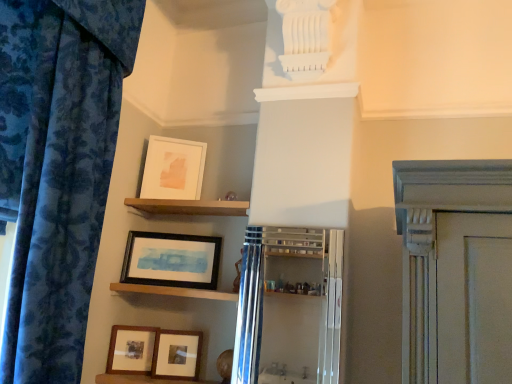
Measure the distance between point (215, 209) and camera.

A distance of 2.06 meters exists between point (215, 209) and camera.

What do you see at coordinates (177, 354) in the screenshot?
I see `wooden matte picture frame at lower center, which ranks as the fourth picture frame in top-to-bottom order` at bounding box center [177, 354].

This screenshot has width=512, height=384. Describe the element at coordinates (173, 291) in the screenshot. I see `wooden shelf at center, the 2th shelf positioned from the top` at that location.

Locate an element on the screen. wooden shelf at upper center, arranged as the 2th shelf when ordered from the bottom is located at coordinates (188, 207).

Is wooden framed picture at center, arranged as the second picture frame when viewed from the top, turned away from matte white picture frame at upper center, the first picture frame in the top-to-bottom sequence?

wooden framed picture at center, arranged as the second picture frame when viewed from the top, does not have its back to matte white picture frame at upper center, the first picture frame in the top-to-bottom sequence.

This screenshot has height=384, width=512. Identify the location of picture frame that is the 1st object to the right of the matte white picture frame at upper center, arranged as the 4th picture frame when ordered from the bottom, starting at the anchor. (170, 260).

Can you confirm if wooden framed picture at center, arranged as the second picture frame when viewed from the top, is smaller than matte white picture frame at upper center, arranged as the 4th picture frame when ordered from the bottom?

No.

Does blue floral fabric curtain at left contain wooden shelf at center, the 2th shelf positioned from the top?

That's incorrect, wooden shelf at center, the 2th shelf positioned from the top, is not inside blue floral fabric curtain at left.

In the scene shown: From the image's perspective, which one is positioned higher, blue floral fabric curtain at left or wooden shelf at center, which is the 1th shelf in bottom-to-top order?

From the image's view, blue floral fabric curtain at left is above.

From a real-world perspective, is blue floral fabric curtain at left physically below wooden shelf at center, the 2th shelf positioned from the top?

Incorrect, from a real-world perspective, blue floral fabric curtain at left is higher than wooden shelf at center, the 2th shelf positioned from the top.

Considering the sizes of objects wooden shelf at center, which is the 1th shelf in bottom-to-top order, and matte black picture frame at lower left, the 3th picture frame in the top-to-bottom sequence, in the image provided, who is shorter, wooden shelf at center, which is the 1th shelf in bottom-to-top order, or matte black picture frame at lower left, the 3th picture frame in the top-to-bottom sequence,?

wooden shelf at center, which is the 1th shelf in bottom-to-top order.

Is wooden shelf at center, the 2th shelf positioned from the top, positioned far away from matte black picture frame at lower left, the 3th picture frame in the top-to-bottom sequence?

They are positioned close to each other.

Looking at the image, does wooden shelf at center, which is the 1th shelf in bottom-to-top order, seem bigger or smaller compared to matte black picture frame at lower left, the 2th picture frame positioned from the bottom?

wooden shelf at center, which is the 1th shelf in bottom-to-top order, is bigger than matte black picture frame at lower left, the 2th picture frame positioned from the bottom.

There is a matte black picture frame at lower left, the 2th picture frame positioned from the bottom. Identify the location of the 1st shelf above it (from the image's perspective). (173, 291).

What's the angular difference between blue floral fabric curtain at left and wooden framed picture at center, arranged as the second picture frame when viewed from the top,'s facing directions?

The angle between the facing direction of blue floral fabric curtain at left and the facing direction of wooden framed picture at center, arranged as the second picture frame when viewed from the top, is 74.5 degrees.

From the image's perspective, count 1st picture frames downward from the blue floral fabric curtain at left and point to it. Please provide its 2D coordinates.

[(170, 260)]

Is point (40, 28) positioned after point (148, 239)?

No, it is not.

Is blue floral fabric curtain at left not inside wooden framed picture at center, arranged as the second picture frame when viewed from the top?

Yes, blue floral fabric curtain at left is not within wooden framed picture at center, arranged as the second picture frame when viewed from the top.

Is wooden matte picture frame at lower center, which ranks as the fourth picture frame in top-to-bottom order, positioned with its back to matte white picture frame at upper center, the first picture frame in the top-to-bottom sequence?

No, wooden matte picture frame at lower center, which ranks as the fourth picture frame in top-to-bottom order, is not facing the opposite direction of matte white picture frame at upper center, the first picture frame in the top-to-bottom sequence.

Which is in front, point (164, 361) or point (189, 190)?

The point (164, 361) is more forward.

Looking at this image, between wooden matte picture frame at lower center, which ranks as the fourth picture frame in top-to-bottom order, and matte white picture frame at upper center, the first picture frame in the top-to-bottom sequence, which one has more height?

Standing taller between the two is matte white picture frame at upper center, the first picture frame in the top-to-bottom sequence.

Would you say wooden matte picture frame at lower center, which ranks as the fourth picture frame in top-to-bottom order, is a long distance from matte white picture frame at upper center, the first picture frame in the top-to-bottom sequence?

wooden matte picture frame at lower center, which ranks as the fourth picture frame in top-to-bottom order, is actually quite close to matte white picture frame at upper center, the first picture frame in the top-to-bottom sequence.

Which object is closer to the camera taking this photo, wooden framed picture at center, arranged as the second picture frame when viewed from the top, or wooden shelf at center, which is the 1th shelf in bottom-to-top order?

wooden shelf at center, which is the 1th shelf in bottom-to-top order, is more forward.

Measure the distance from wooden framed picture at center, arranged as the second picture frame when viewed from the top, to wooden shelf at center, which is the 1th shelf in bottom-to-top order.

wooden framed picture at center, arranged as the second picture frame when viewed from the top, is 5.58 inches from wooden shelf at center, which is the 1th shelf in bottom-to-top order.

From the image's perspective, is wooden framed picture at center, which is the third picture frame in bottom-to-top order, located beneath wooden shelf at center, which is the 1th shelf in bottom-to-top order?

No.

In the scene shown: Can you confirm if wooden framed picture at center, which is the third picture frame in bottom-to-top order, is shorter than wooden shelf at center, which is the 1th shelf in bottom-to-top order?

Incorrect, the height of wooden framed picture at center, which is the third picture frame in bottom-to-top order, does not fall short of that of wooden shelf at center, which is the 1th shelf in bottom-to-top order.

Is matte black picture frame at lower left, the 3th picture frame in the top-to-bottom sequence, facing away from wooden shelf at center, which is the 1th shelf in bottom-to-top order?

matte black picture frame at lower left, the 3th picture frame in the top-to-bottom sequence, does not have its back to wooden shelf at center, which is the 1th shelf in bottom-to-top order.

From the image's perspective, relative to wooden shelf at center, which is the 1th shelf in bottom-to-top order, is matte black picture frame at lower left, the 3th picture frame in the top-to-bottom sequence, above or below?

Based on their image positions, matte black picture frame at lower left, the 3th picture frame in the top-to-bottom sequence, is located beneath wooden shelf at center, which is the 1th shelf in bottom-to-top order.

Is matte black picture frame at lower left, the 3th picture frame in the top-to-bottom sequence, directly adjacent to wooden shelf at center, the 2th shelf positioned from the top?

matte black picture frame at lower left, the 3th picture frame in the top-to-bottom sequence, and wooden shelf at center, the 2th shelf positioned from the top, are clearly separated.

From the matte white picture frame at upper center, arranged as the 4th picture frame when ordered from the bottom, count 1st picture frames forward and point to it. Please provide its 2D coordinates.

[(170, 260)]

The height and width of the screenshot is (384, 512). I want to click on the 1st shelf to the right of the blue floral fabric curtain at left, starting your count from the anchor, so click(173, 291).

Based on their spatial positions, is matte black picture frame at lower left, the 2th picture frame positioned from the bottom, or clear glass cabinet at center closer to wooden shelf at upper center, arranged as the 2th shelf when ordered from the bottom?

clear glass cabinet at center is positioned closer to the anchor wooden shelf at upper center, arranged as the 2th shelf when ordered from the bottom.

Estimate the real-world distances between objects in this image. Which object is further from wooden matte picture frame at lower center, which ranks as the fourth picture frame in top-to-bottom order, wooden framed picture at center, which is the third picture frame in bottom-to-top order, or matte black picture frame at lower left, the 3th picture frame in the top-to-bottom sequence?

Based on the image, wooden framed picture at center, which is the third picture frame in bottom-to-top order, appears to be further to wooden matte picture frame at lower center, which ranks as the fourth picture frame in top-to-bottom order.

From the image, which object appears to be nearer to wooden shelf at upper center, the first shelf in the top-to-bottom sequence, wooden matte picture frame at lower center, positioned as the first picture frame in bottom-to-top order, or matte black picture frame at lower left, the 2th picture frame positioned from the bottom?

Based on the image, matte black picture frame at lower left, the 2th picture frame positioned from the bottom, appears to be nearer to wooden shelf at upper center, the first shelf in the top-to-bottom sequence.

Looking at the image, which one is located closer to blue floral fabric curtain at left, wooden shelf at center, which is the 1th shelf in bottom-to-top order, or wooden framed picture at center, arranged as the second picture frame when viewed from the top?

wooden framed picture at center, arranged as the second picture frame when viewed from the top, lies closer to blue floral fabric curtain at left than the other object.

When comparing their distances from wooden shelf at upper center, arranged as the 2th shelf when ordered from the bottom, does wooden matte picture frame at lower center, positioned as the first picture frame in bottom-to-top order, or wooden shelf at center, which is the 1th shelf in bottom-to-top order, seem closer?

wooden shelf at center, which is the 1th shelf in bottom-to-top order, lies closer to wooden shelf at upper center, arranged as the 2th shelf when ordered from the bottom, than the other object.

Consider the image. Looking at the image, which one is located further to matte white picture frame at upper center, the first picture frame in the top-to-bottom sequence, clear glass cabinet at center or wooden shelf at upper center, the first shelf in the top-to-bottom sequence?

The object further to matte white picture frame at upper center, the first picture frame in the top-to-bottom sequence, is clear glass cabinet at center.

Looking at this image, considering their positions, is clear glass cabinet at center positioned further to blue floral fabric curtain at left than wooden framed picture at center, which is the third picture frame in bottom-to-top order?

Based on the image, clear glass cabinet at center appears to be further to blue floral fabric curtain at left.

Which object lies further to the anchor point blue floral fabric curtain at left, clear glass cabinet at center or matte white picture frame at upper center, arranged as the 4th picture frame when ordered from the bottom?

clear glass cabinet at center lies further to blue floral fabric curtain at left than the other object.

Where is `picture frame between wooden shelf at upper center, the first shelf in the top-to-bottom sequence, and wooden shelf at center, which is the 1th shelf in bottom-to-top order, vertically`? The image size is (512, 384). picture frame between wooden shelf at upper center, the first shelf in the top-to-bottom sequence, and wooden shelf at center, which is the 1th shelf in bottom-to-top order, vertically is located at coordinates (170, 260).

Where is `picture frame that lies between wooden shelf at center, the 2th shelf positioned from the top, and wooden matte picture frame at lower center, positioned as the first picture frame in bottom-to-top order, from top to bottom`? The width and height of the screenshot is (512, 384). picture frame that lies between wooden shelf at center, the 2th shelf positioned from the top, and wooden matte picture frame at lower center, positioned as the first picture frame in bottom-to-top order, from top to bottom is located at coordinates (131, 350).

This screenshot has width=512, height=384. Find the location of `shelf between wooden framed picture at center, arranged as the second picture frame when viewed from the top, and wooden matte picture frame at lower center, positioned as the first picture frame in bottom-to-top order, from top to bottom`. shelf between wooden framed picture at center, arranged as the second picture frame when viewed from the top, and wooden matte picture frame at lower center, positioned as the first picture frame in bottom-to-top order, from top to bottom is located at coordinates (173, 291).

Locate an element on the screen. picture frame situated between wooden framed picture at center, arranged as the second picture frame when viewed from the top, and clear glass cabinet at center from left to right is located at coordinates (177, 354).